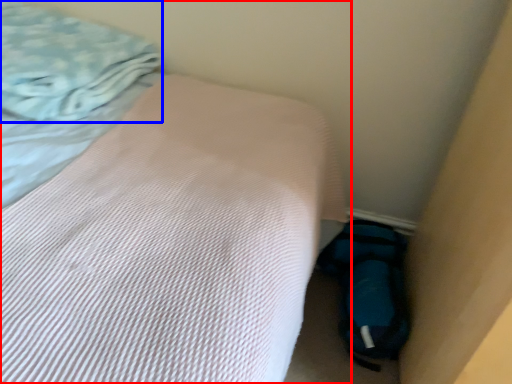
Question: Which point is closer to the camera, bed (highlighted by a red box) or blanket (highlighted by a blue box)?

Choices:
 (A) bed
 (B) blanket

Answer: (A)